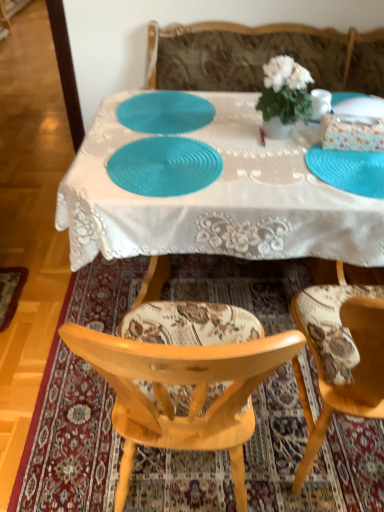
You are a GUI agent. You are given a task and a screenshot of the screen. Output one action in this format:
    pyautogui.click(x=<x>, y=<y>)
    Task: Click on the vacant area located to the right-hand side of teal textured plate at center, acting as the 2th plate starting from the left
    The height and width of the screenshot is (512, 384).
    Given the screenshot: What is the action you would take?
    pyautogui.click(x=271, y=170)